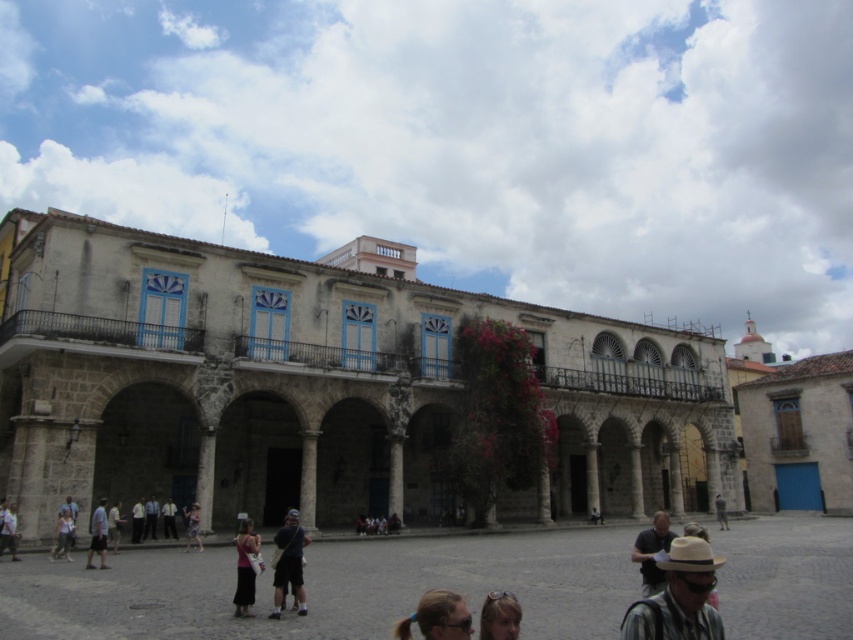
Is point (248, 528) behind point (189, 520)?

That is False.

Does point (241, 592) come closer to viewer compared to point (198, 536)?

Yes, it is.

Locate an element on the screen. The width and height of the screenshot is (853, 640). pink fabric dress at center is located at coordinates (245, 568).

The image size is (853, 640). What are the coordinates of `pink fabric dress at center` in the screenshot? It's located at (245, 568).

Consider the image. Does brown stone courtyard at center appear under dark gray fabric backpack at center?

Correct, brown stone courtyard at center is located below dark gray fabric backpack at center.

Is point (38, 557) farther from camera compared to point (299, 605)?

Yes, point (38, 557) is behind point (299, 605).

Is point (82, 573) positioned behind point (273, 573)?

That is False.

Find the location of a particular element. The height and width of the screenshot is (640, 853). brown stone courtyard at center is located at coordinates (328, 588).

Which is in front, point (451, 609) or point (248, 525)?

Point (451, 609)

Can you confirm if blonde hair at lower center is positioned to the left of pink fabric dress at center?

Incorrect, blonde hair at lower center is not on the left side of pink fabric dress at center.

Between point (399, 632) and point (236, 593), which one is positioned in front?

Point (399, 632) is in front.

Where is `blonde hair at lower center`? This screenshot has height=640, width=853. blonde hair at lower center is located at coordinates (437, 618).